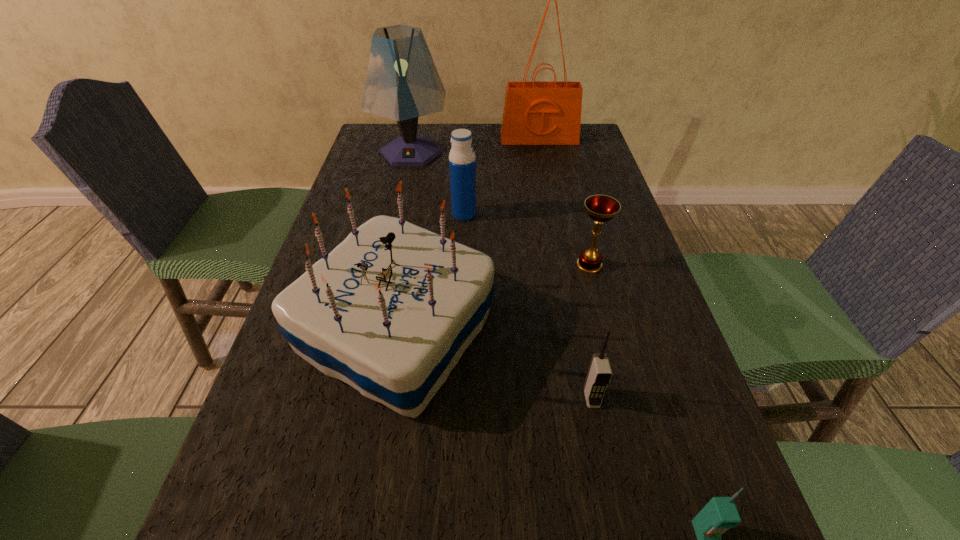
Identify the location of vacant region between the taller cellular telephone and the birthday cake. (494, 364).

Identify the location of empty space that is in between the taller cellular telephone and the second tallest object. The height and width of the screenshot is (540, 960). (501, 275).

The height and width of the screenshot is (540, 960). Identify the location of the sixth closest object relative to the farther cellular telephone. (535, 113).

Where is `object that ranks as the sixth closest to the third farthest object`? The width and height of the screenshot is (960, 540). object that ranks as the sixth closest to the third farthest object is located at coordinates (720, 513).

Where is `free point that satisfies the following two spatial constraints: 1. on the base of the lampshade; 2. on the left side of the water bottle`? free point that satisfies the following two spatial constraints: 1. on the base of the lampshade; 2. on the left side of the water bottle is located at coordinates (397, 214).